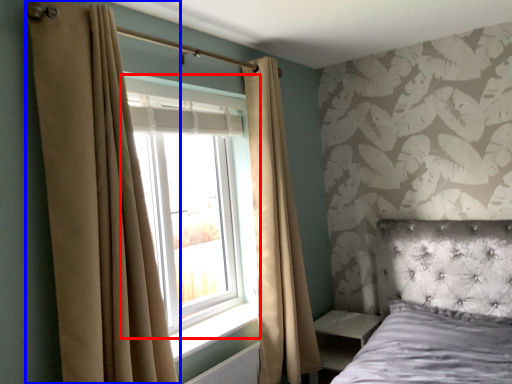
Question: Which object is closer to the camera taking this photo, window (highlighted by a red box) or curtain (highlighted by a blue box)?

Choices:
 (A) window
 (B) curtain

Answer: (B)